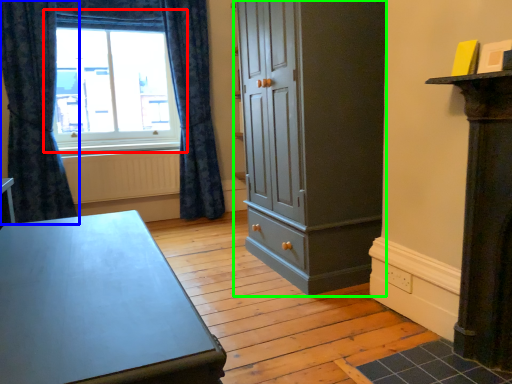
Question: Which is farther away from window (highlighted by a red box)? curtain (highlighted by a blue box) or cupboard (highlighted by a green box)?

Choices:
 (A) curtain
 (B) cupboard

Answer: (B)